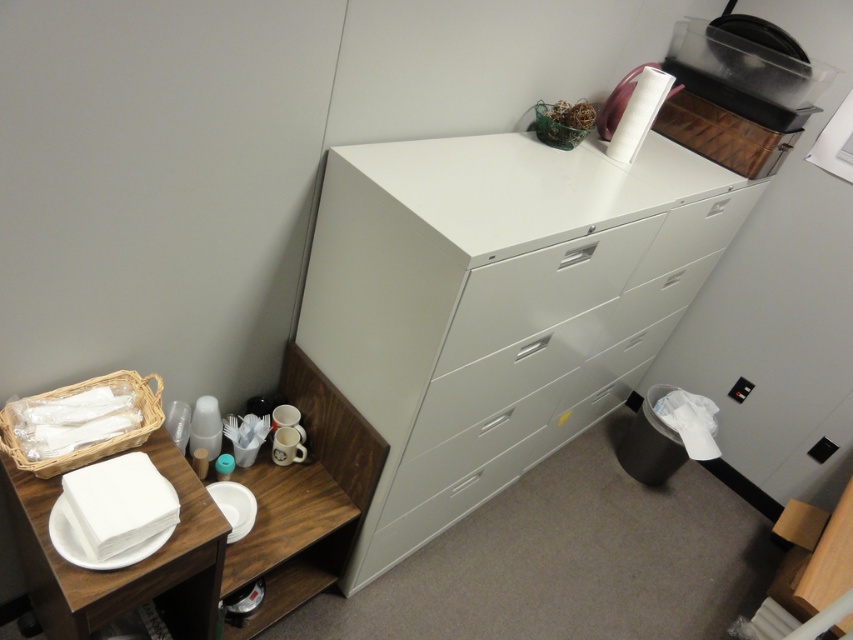
Is white matte/file cabinet at upper center further to camera compared to white matte plate at lower left?

No, white matte/file cabinet at upper center is closer to the viewer.

The image size is (853, 640). What do you see at coordinates (496, 304) in the screenshot?
I see `white matte/file cabinet at upper center` at bounding box center [496, 304].

The height and width of the screenshot is (640, 853). What do you see at coordinates (496, 304) in the screenshot?
I see `white matte/file cabinet at upper center` at bounding box center [496, 304].

At what (x,y) coordinates should I click in order to perform the action: click on white matte/file cabinet at upper center. Please return your answer as a coordinate pair (x, y). Looking at the image, I should click on (496, 304).

Who is lower down, white matte/file cabinet at upper center or white paper plate at lower left?

white paper plate at lower left

Does white matte/file cabinet at upper center appear under white paper plate at lower left?

No.

In the scene shown: Who is more distant from viewer, (656, 276) or (113, 566)?

The point (656, 276) is behind.

Locate an element on the screen. The image size is (853, 640). white matte/file cabinet at upper center is located at coordinates (496, 304).

Between white matte drawer at center and white paper plate at lower left, which one appears on the left side from the viewer's perspective?

white paper plate at lower left

Is point (480, 323) behind point (79, 524)?

Yes, it is.

Does point (555, 248) lie behind point (91, 557)?

Yes, point (555, 248) is farther from viewer.

Locate an element on the screen. Image resolution: width=853 pixels, height=640 pixels. white matte drawer at center is located at coordinates (540, 291).